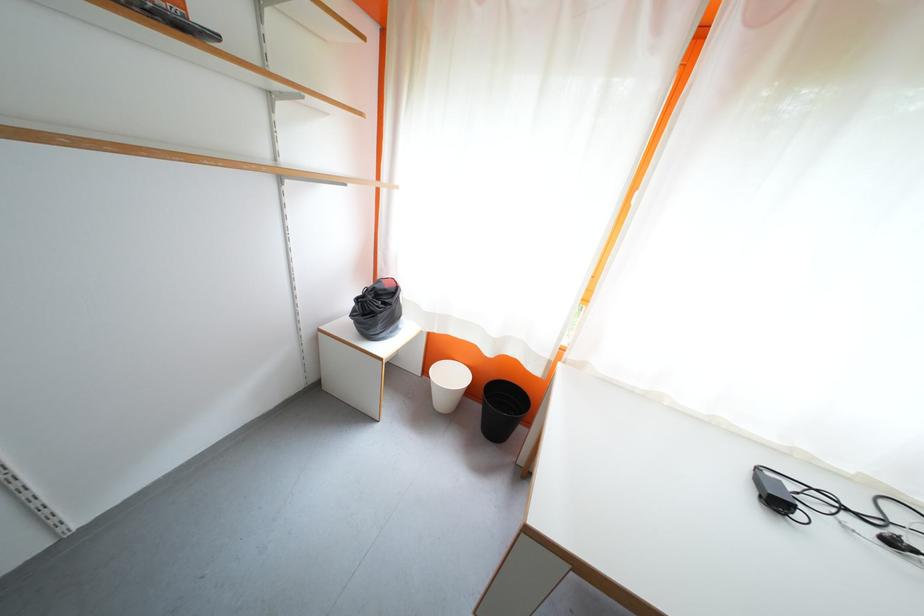
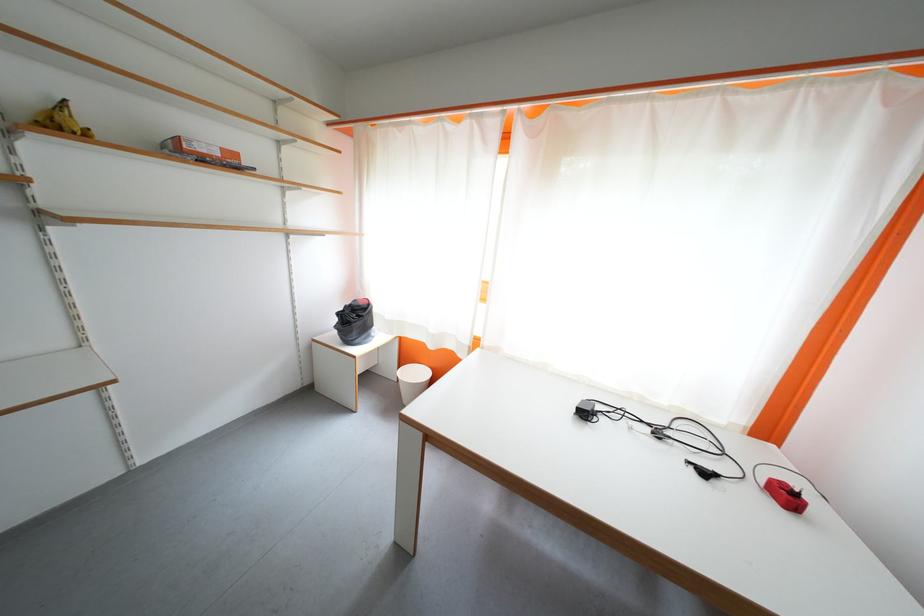
Locate, in the second image, the point that corresponds to (496,355) in the first image.

(440, 350)